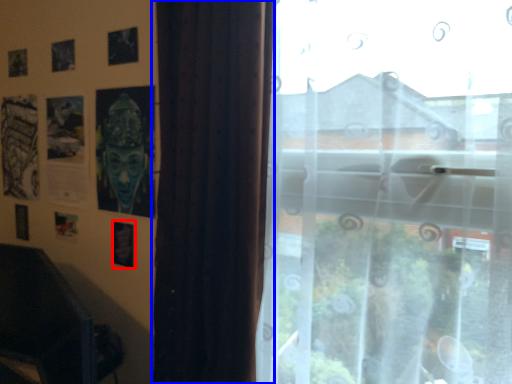
Question: Which point is closer to the camera, picture frame (highlighted by a red box) or curtain (highlighted by a blue box)?

Choices:
 (A) picture frame
 (B) curtain

Answer: (B)